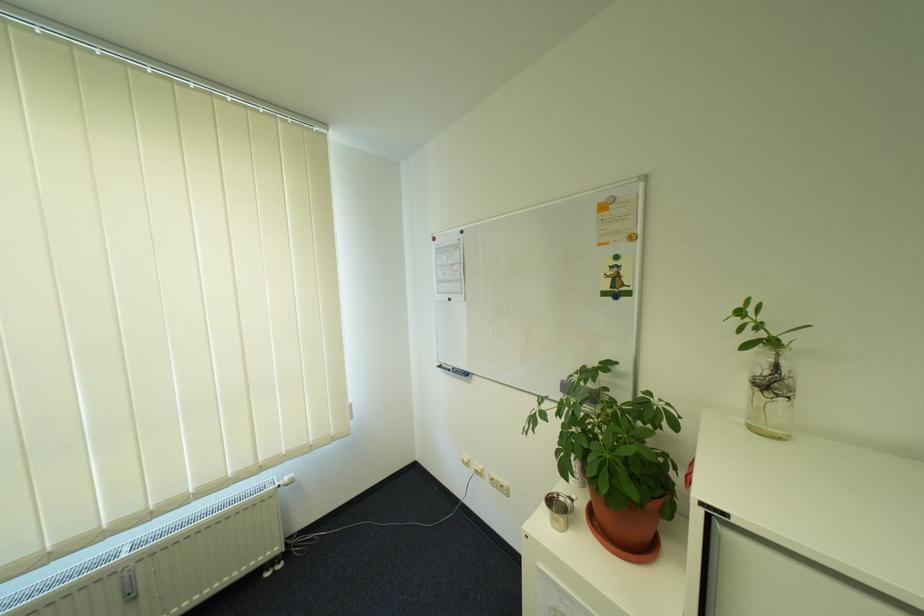
The width and height of the screenshot is (924, 616). Find the location of `red round magnet`. red round magnet is located at coordinates (438, 238).